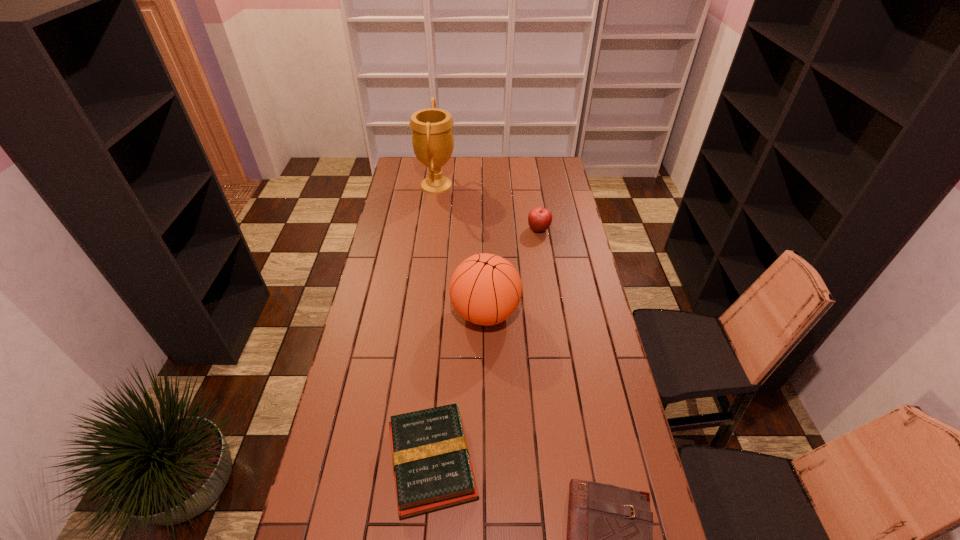
This screenshot has width=960, height=540. Identify the location of free space located 0.290m on the front of the third shortest object. (547, 282).

Locate an element on the screen. The height and width of the screenshot is (540, 960). blank area located 0.070m on the right of the left hardback book is located at coordinates (504, 462).

The height and width of the screenshot is (540, 960). What are the coordinates of `object located at the far edge` in the screenshot? It's located at (432, 137).

At what (x,y) coordinates should I click in order to perform the action: click on object positioned at the left edge. Please return your answer as a coordinate pair (x, y). The width and height of the screenshot is (960, 540). Looking at the image, I should click on (432, 137).

Image resolution: width=960 pixels, height=540 pixels. Identify the location of object that is at the right edge. (539, 219).

The width and height of the screenshot is (960, 540). What are the coordinates of `object at the far left corner` in the screenshot? It's located at (432, 137).

The height and width of the screenshot is (540, 960). I want to click on vacant region at the left edge of the desktop, so click(388, 279).

You are a GUI agent. You are given a task and a screenshot of the screen. Output one action in this format:
    pyautogui.click(x=<x>, y=<y>)
    Task: Click on the vacant space at the right edge of the desktop
    Image resolution: width=960 pixels, height=540 pixels.
    Given the screenshot: What is the action you would take?
    pyautogui.click(x=609, y=366)

The width and height of the screenshot is (960, 540). What are the coordinates of `vacant area between the trophy and the fourth shortest object` in the screenshot? It's located at (461, 249).

Find the location of `vacant area that lies between the third tallest object and the trophy`. vacant area that lies between the third tallest object and the trophy is located at coordinates (488, 207).